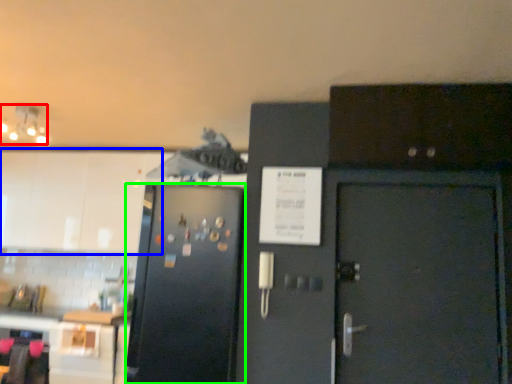
Question: Estimate the real-world distances between objects in this image. Which object is farther from lamp (highlighted by a red box), cabinetry (highlighted by a blue box) or refrigerator (highlighted by a green box)?

Choices:
 (A) cabinetry
 (B) refrigerator

Answer: (B)